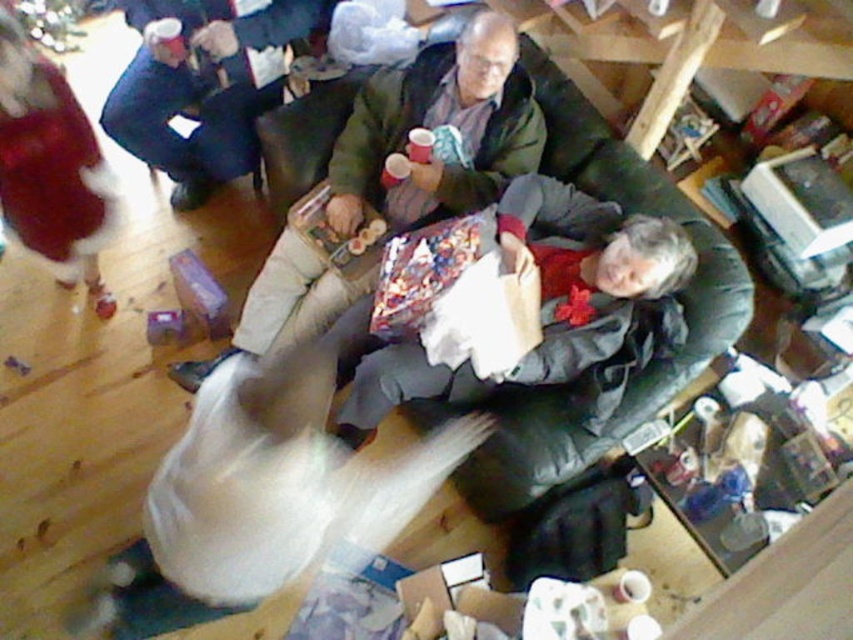
Does dark green leather couch at center have a smaller size compared to green matte christmas tree at upper left?

No, dark green leather couch at center is not smaller than green matte christmas tree at upper left.

Looking at this image, who is shorter, dark green leather couch at center or green matte christmas tree at upper left?

With less height is green matte christmas tree at upper left.

Find the location of a particular element. dark green leather couch at center is located at coordinates (682, 298).

Where is `dark green leather couch at center`? This screenshot has height=640, width=853. dark green leather couch at center is located at coordinates (682, 298).

Based on the photo, does green fabric jacket at center appear on the right side of green matte christmas tree at upper left?

Indeed, green fabric jacket at center is positioned on the right side of green matte christmas tree at upper left.

Which is more to the left, green fabric jacket at center or green matte christmas tree at upper left?

green matte christmas tree at upper left is more to the left.

Between point (508, 54) and point (30, 1), which one is positioned in front?

Point (508, 54) is in front.

Where is `green fabric jacket at center`? Image resolution: width=853 pixels, height=640 pixels. green fabric jacket at center is located at coordinates (440, 132).

Between green fabric jacket at center and dark blue jeans at upper left, which one has less height?

dark blue jeans at upper left is shorter.

Can you confirm if green fabric jacket at center is wider than dark blue jeans at upper left?

Yes.

Between point (383, 173) and point (195, 58), which one is positioned behind?

The point (195, 58) is behind.

Where is `green fabric jacket at center`? This screenshot has height=640, width=853. green fabric jacket at center is located at coordinates (440, 132).